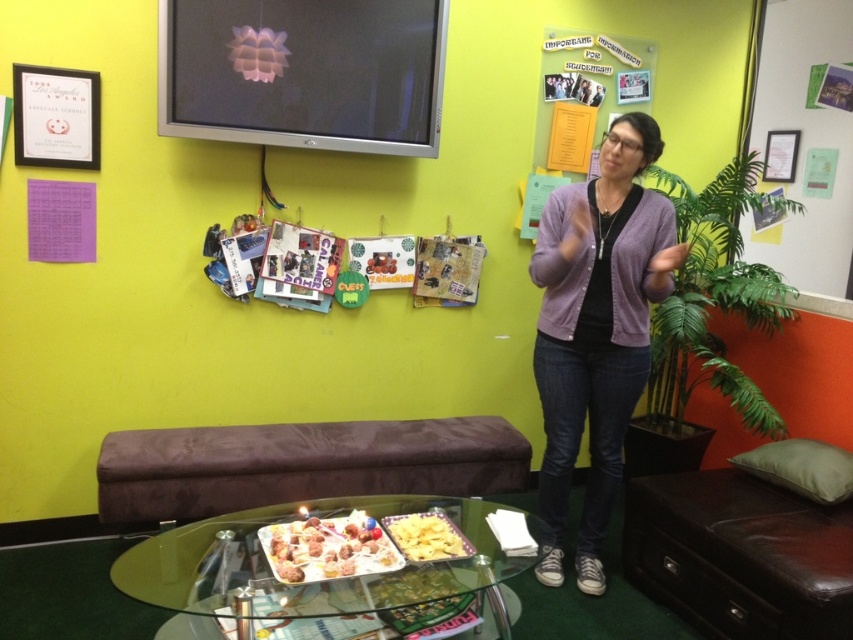
Image resolution: width=853 pixels, height=640 pixels. I want to click on brown suede bench at lower center, so (x=300, y=465).

Which is above, brown suede bench at lower center or shiny metallic tray at lower center?

Positioned higher is brown suede bench at lower center.

Does point (447, 440) come closer to viewer compared to point (305, 563)?

No, it is not.

The height and width of the screenshot is (640, 853). Find the location of `brown suede bench at lower center`. brown suede bench at lower center is located at coordinates (300, 465).

Who is positioned more to the left, brown leather couch at lower right or shiny metallic tray at lower center?

shiny metallic tray at lower center is more to the left.

What do you see at coordinates (740, 554) in the screenshot? Image resolution: width=853 pixels, height=640 pixels. I see `brown leather couch at lower right` at bounding box center [740, 554].

Find the location of `brown leather couch at lower right`. brown leather couch at lower right is located at coordinates (740, 554).

Locate an element on the screen. brown leather couch at lower right is located at coordinates (740, 554).

Is purple knit cardigan at center thinner than brown suede bench at lower center?

Yes.

From the picture: Is purple knit cardigan at center to the left of brown suede bench at lower center from the viewer's perspective?

In fact, purple knit cardigan at center is to the right of brown suede bench at lower center.

The image size is (853, 640). Describe the element at coordinates (596, 330) in the screenshot. I see `purple knit cardigan at center` at that location.

Where is `purple knit cardigan at center`? This screenshot has height=640, width=853. purple knit cardigan at center is located at coordinates (596, 330).